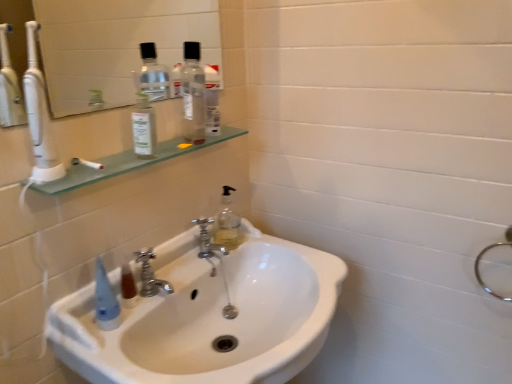
Image resolution: width=512 pixels, height=384 pixels. I want to click on empty space that is ontop of transparent glass shelf at upper left (from a real-world perspective), so click(175, 149).